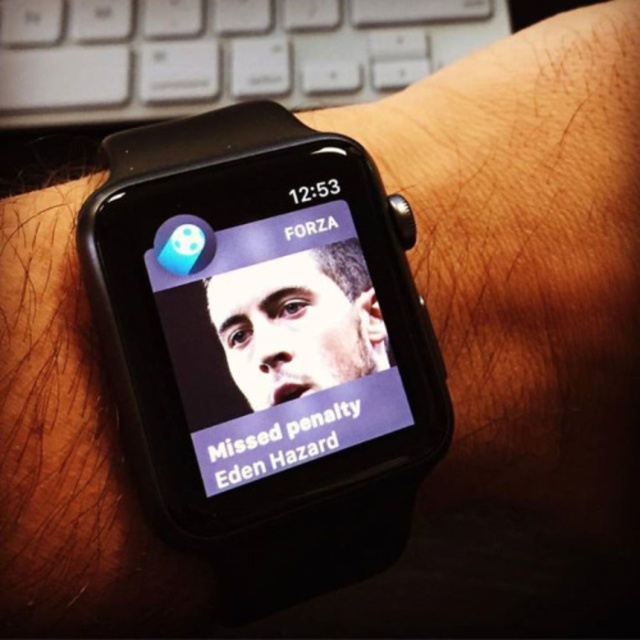
Does black matte smartwatch at center appear on the left side of smooth skin face at center?

Indeed, black matte smartwatch at center is positioned on the left side of smooth skin face at center.

Does black matte smartwatch at center have a smaller size compared to smooth skin face at center?

Incorrect, black matte smartwatch at center is not smaller in size than smooth skin face at center.

Find the location of `black matte smartwatch at center`. black matte smartwatch at center is located at coordinates (259, 317).

Who is taller, white plastic keyboard at upper left or smooth skin face at center?

white plastic keyboard at upper left is taller.

Does point (250, 49) come in front of point (353, 340)?

No, (250, 49) is behind (353, 340).

The image size is (640, 640). What are the coordinates of `white plastic keyboard at upper left` in the screenshot? It's located at (221, 52).

Where is `white plastic keyboard at upper left`? This screenshot has height=640, width=640. white plastic keyboard at upper left is located at coordinates (221, 52).

How far apart are matte purple watch face at center and smooth skin face at center?

They are 0.45 inches apart.

Who is more forward, (353, 276) or (291, 308)?

Point (291, 308) is more forward.

Which is in front, point (362, 285) or point (259, 298)?

Positioned in front is point (259, 298).

Locate an element on the screen. matte purple watch face at center is located at coordinates (273, 340).